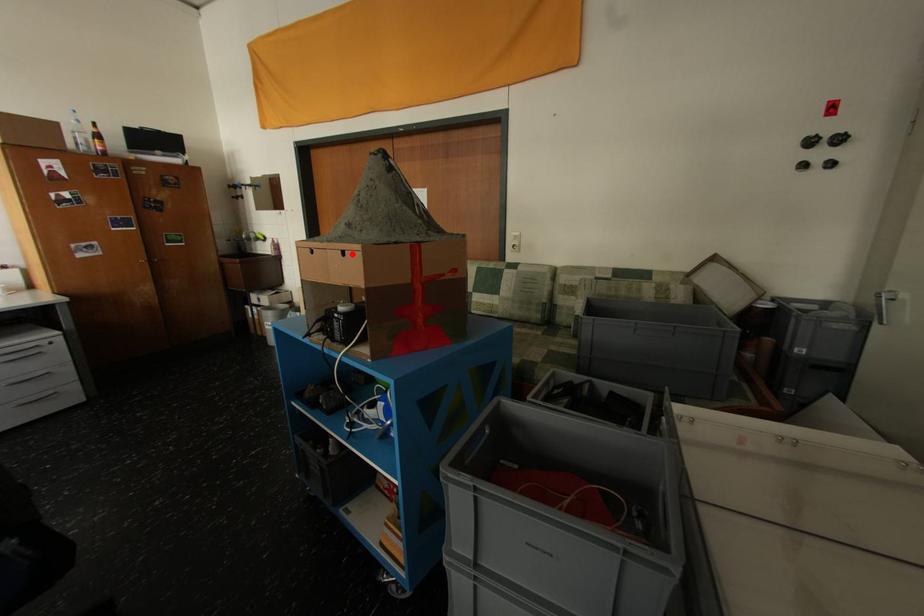
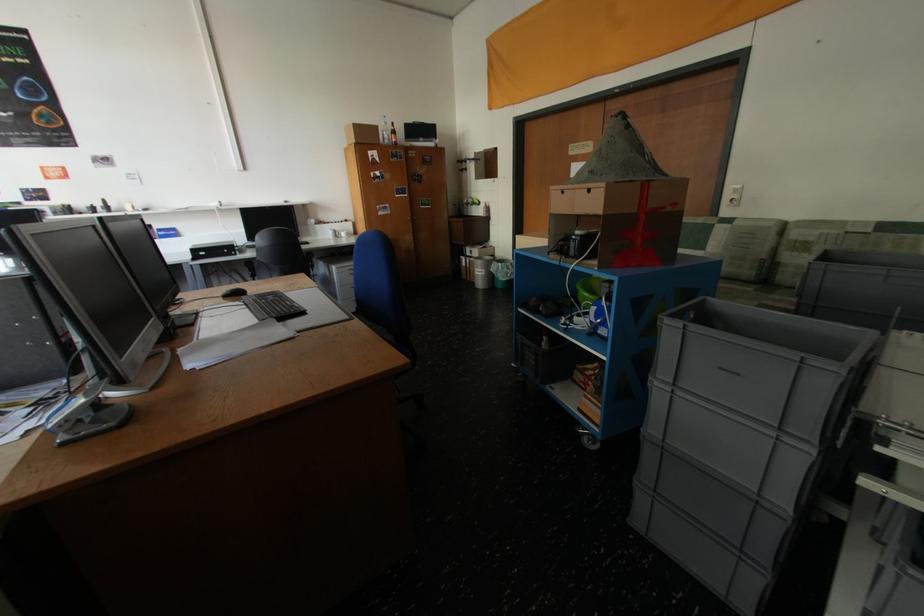
Where in the second image is the point corresponding to the highlighted location from the first image?

(598, 192)